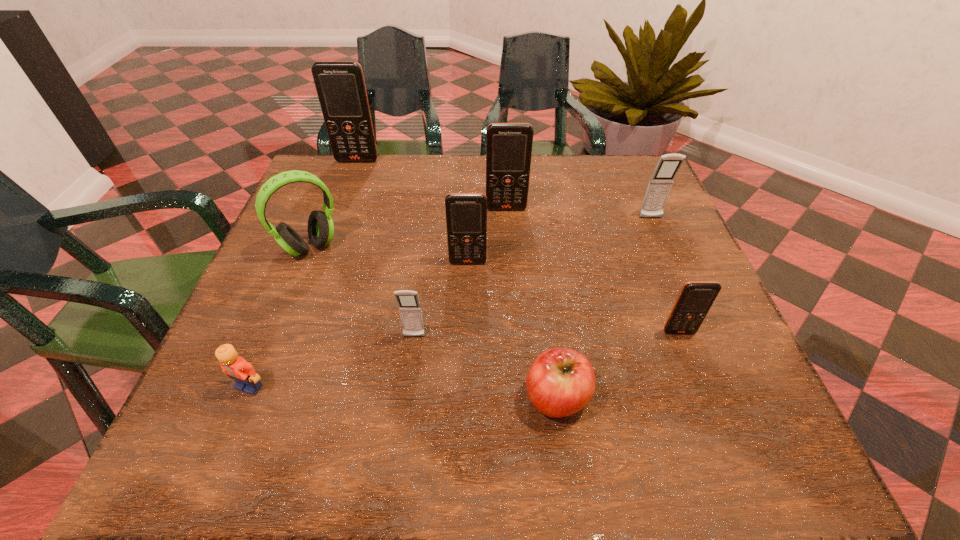
This screenshot has height=540, width=960. In order to click on the smallest orange cellular telephone in this screenshot , I will do `click(695, 299)`.

What are the coordinates of `the fourth object from left to right` in the screenshot? It's located at (410, 311).

Where is `the second cellular telephone from left to right`? the second cellular telephone from left to right is located at coordinates (410, 311).

Image resolution: width=960 pixels, height=540 pixels. I want to click on Lego, so click(242, 372).

The image size is (960, 540). I want to click on red apple, so click(x=561, y=381).

You are a GUI agent. You are given a task and a screenshot of the screen. Output one action in this format:
    pyautogui.click(x=<x>, y=<y>)
    Task: Click on the vacant space located on the screen of the tallest object
    Image resolution: width=960 pixels, height=540 pixels.
    Given the screenshot: What is the action you would take?
    pyautogui.click(x=345, y=195)

Find the location of a particular element. This screenshot has width=960, height=540. free space located on the screen of the second biggest orange cellular telephone is located at coordinates (510, 263).

Identify the location of vacant region located on the right of the green headset. The width and height of the screenshot is (960, 540). (430, 247).

In order to click on blank area located on the front-facing side of the bigger gray cellular telephone in this screenshot , I will do `click(705, 345)`.

Find the location of a particular element. vacant region located on the screen of the fourth farthest cellular telephone is located at coordinates (468, 286).